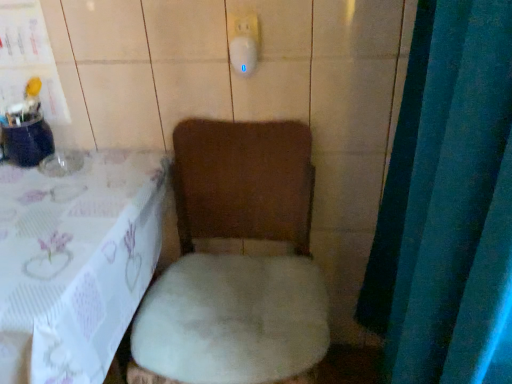
Question: From a real-world perspective, is blue fabric curtain at right above or below white plush toilet at center?

Choices:
 (A) above
 (B) below

Answer: (A)

Question: In terms of width, does blue fabric curtain at right look wider or thinner when compared to white plush toilet at center?

Choices:
 (A) thin
 (B) wide

Answer: (A)

Question: Which of these objects is positioned closest to the white plush toilet at center?

Choices:
 (A) blue fabric curtain at right
 (B) white plush chair at lower left

Answer: (B)

Question: Considering the real-world distances, which object is farthest from the blue fabric curtain at right?

Choices:
 (A) white plush toilet at center
 (B) white plush chair at lower left

Answer: (B)